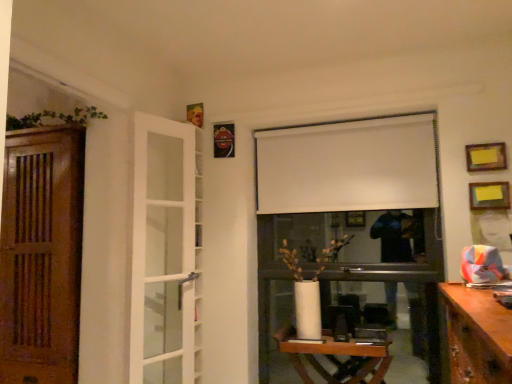
Question: Considering the positions of white glass door at left, the 2th door from the left, and metallic rectangular frame at upper center, which is counted as the first picture frame, starting from the back, in the image, is white glass door at left, the 2th door from the left, taller or shorter than metallic rectangular frame at upper center, which is counted as the first picture frame, starting from the back,?

Choices:
 (A) short
 (B) tall

Answer: (B)

Question: From the image's perspective, is white glass door at left, the 2th door from the left, positioned above or below metallic rectangular frame at upper center, the 1th picture frame when ordered from left to right?

Choices:
 (A) above
 (B) below

Answer: (B)

Question: Which of these objects is positioned farthest from the yellow paper at upper right, marked as the third picture frame in a left-to-right arrangement?

Choices:
 (A) wooden at left, placed as the 2th door when sorted from right to left
 (B) yellow paper at upper right, which is the 2th picture frame from front to back
 (C) metallic rectangular frame at upper center, which appears as the third picture frame when viewed from the right
 (D) white glass door at left, the first door when ordered from right to left
 (E) wooden table at center

Answer: (A)

Question: Which of these objects is positioned farthest from the wooden at left, placed as the 2th door when sorted from right to left?

Choices:
 (A) metallic rectangular frame at upper center, the 1th picture frame when ordered from left to right
 (B) white glass door at left, the 2th door from the left
 (C) yellow paper at upper right, marked as the first picture frame in a right-to-left arrangement
 (D) white matte curtain at upper center
 (E) yellow paper at upper right, which is the 2th picture frame from front to back

Answer: (E)